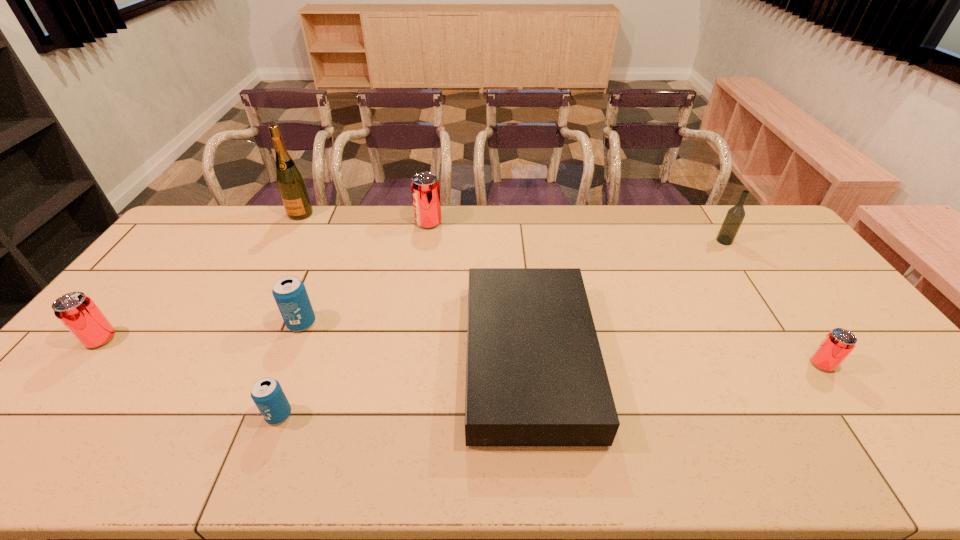
Find the location of a particular element. This screenshot has width=960, height=540. object at the right edge is located at coordinates (837, 345).

Find the location of a particular element. The image size is (960, 540). free space at the far edge of the desktop is located at coordinates (373, 223).

In order to click on vacant space at the near edge in this screenshot , I will do `click(760, 450)`.

This screenshot has height=540, width=960. In order to click on free space at the right edge of the desktop in this screenshot , I will do `click(793, 272)`.

The width and height of the screenshot is (960, 540). I want to click on vacant position at the far left corner of the desktop, so click(224, 232).

I want to click on free space at the far right corner of the desktop, so pos(763,237).

Locate an element on the screen. This screenshot has height=540, width=960. empty location between the third farthest object and the biggest red soda can is located at coordinates (576, 232).

Locate an element on the screen. empty location between the nearest soda can and the bigger blue soda can is located at coordinates (290, 369).

In order to click on free space between the leftmost object and the farthest soda can in this screenshot , I will do `click(265, 281)`.

Where is `vacant area between the sixth nearest object and the farthest soda can`? The height and width of the screenshot is (540, 960). vacant area between the sixth nearest object and the farthest soda can is located at coordinates (576, 232).